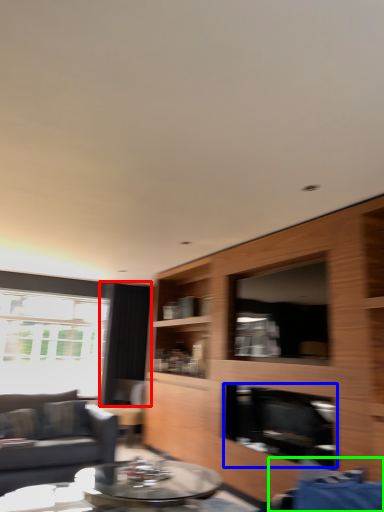
Question: Which object is positioned farthest from curtain (highlighted by a red box)? Select from fireplace (highlighted by a blue box) and swivel chair (highlighted by a green box).

Choices:
 (A) fireplace
 (B) swivel chair

Answer: (B)